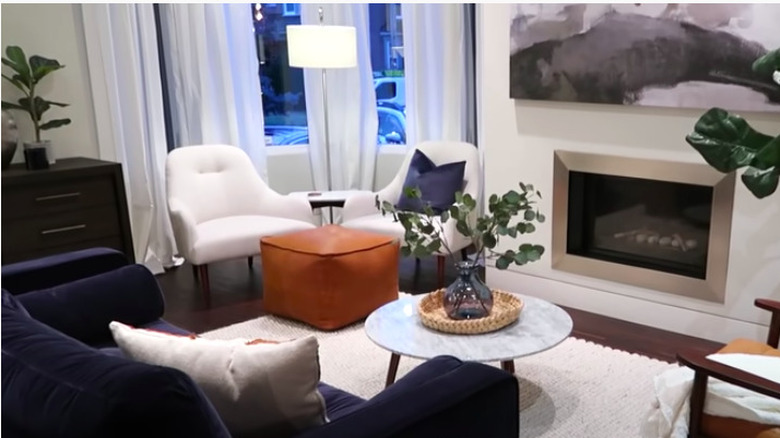
Where is `ottoman`? ottoman is located at coordinates (335, 270).